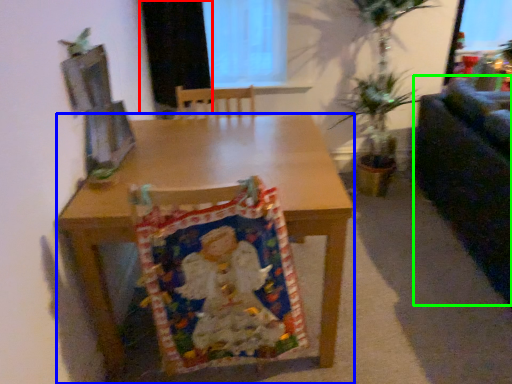
Question: Based on their relative distances, which object is farther from curtain (highlighted by a red box)? Choose from desk (highlighted by a blue box) and couch (highlighted by a green box).

Choices:
 (A) desk
 (B) couch

Answer: (B)